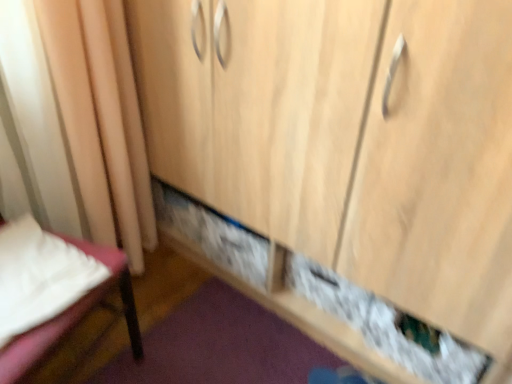
Question: From a real-world perspective, does beige fabric curtain at left stand above white fabric bed at lower left?

Choices:
 (A) no
 (B) yes

Answer: (B)

Question: Is white fabric bed at lower left at the back of beige fabric curtain at left?

Choices:
 (A) yes
 (B) no

Answer: (B)

Question: Can you confirm if beige fabric curtain at left is bigger than white fabric bed at lower left?

Choices:
 (A) yes
 (B) no

Answer: (A)

Question: From a real-world perspective, is beige fabric curtain at left positioned under white fabric bed at lower left based on gravity?

Choices:
 (A) no
 (B) yes

Answer: (A)

Question: Does beige fabric curtain at left have a lesser width compared to white fabric bed at lower left?

Choices:
 (A) no
 (B) yes

Answer: (B)

Question: From the image's perspective, is beige fabric curtain at left under white fabric bed at lower left?

Choices:
 (A) no
 (B) yes

Answer: (A)

Question: Considering the relative positions of white fabric bed at lower left and beige fabric curtain at left in the image provided, is white fabric bed at lower left to the right of beige fabric curtain at left from the viewer's perspective?

Choices:
 (A) yes
 (B) no

Answer: (B)

Question: Can beige fabric curtain at left be found inside white fabric bed at lower left?

Choices:
 (A) yes
 (B) no

Answer: (B)

Question: Is white fabric bed at lower left not inside beige fabric curtain at left?

Choices:
 (A) no
 (B) yes

Answer: (B)

Question: Could you tell me if white fabric bed at lower left is facing beige fabric curtain at left?

Choices:
 (A) yes
 (B) no

Answer: (B)

Question: Is white fabric bed at lower left looking in the opposite direction of beige fabric curtain at left?

Choices:
 (A) yes
 (B) no

Answer: (B)

Question: Does white fabric bed at lower left appear on the left side of beige fabric curtain at left?

Choices:
 (A) yes
 (B) no

Answer: (A)

Question: Is point (145, 168) closer or farther from the camera than point (3, 221)?

Choices:
 (A) farther
 (B) closer

Answer: (A)